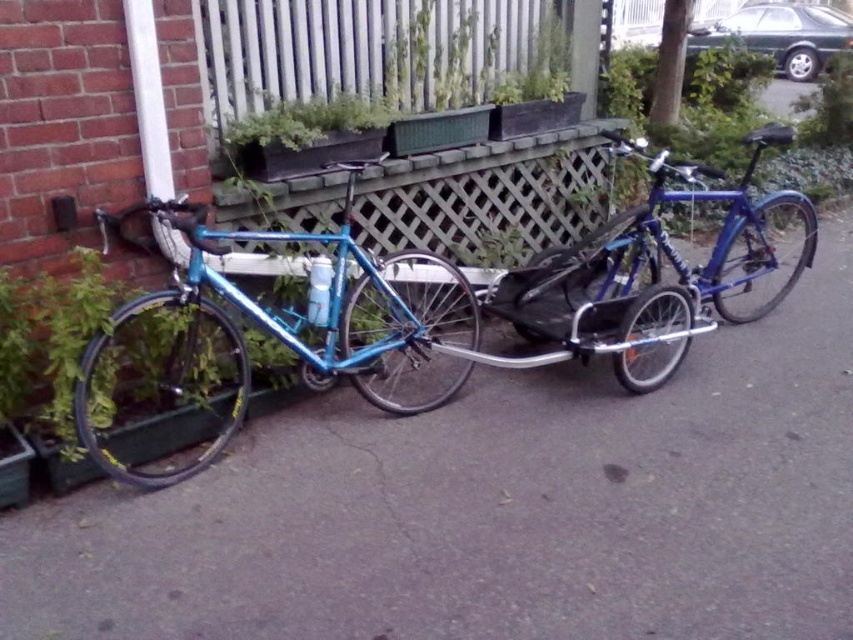
Which is in front, point (701, 317) or point (300, 100)?

Positioned in front is point (300, 100).

Between point (524, 307) and point (253, 120), which one is positioned in front?

Positioned in front is point (253, 120).

This screenshot has width=853, height=640. I want to click on blue metallic bicycle at center, so click(x=608, y=280).

You are a GUI agent. You are given a task and a screenshot of the screen. Output one action in this format:
    pyautogui.click(x=<x>, y=<y>)
    Task: Click on the matte blue bicycle at center
    Image resolution: width=853 pixels, height=640 pixels.
    Given the screenshot: What is the action you would take?
    pyautogui.click(x=494, y=508)

Who is more forward, (326,285) or (511,250)?

Point (326,285)

Is matte blue bicycle at left further to the viewer compared to green leafy plant at center?

No, it is not.

At what (x,y) coordinates should I click in order to perform the action: click on matte blue bicycle at left. Please return your answer as a coordinate pair (x, y). Image resolution: width=853 pixels, height=640 pixels. Looking at the image, I should click on (271, 324).